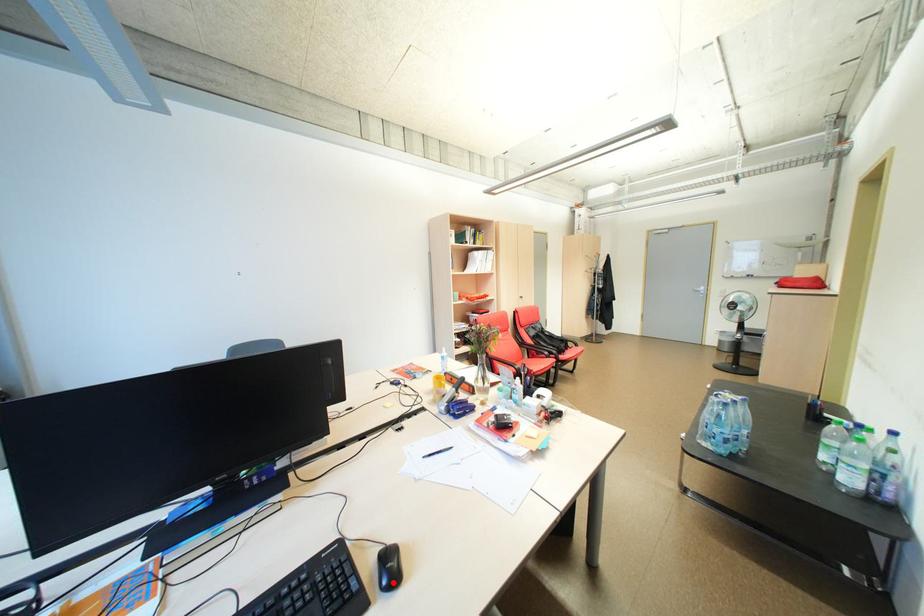
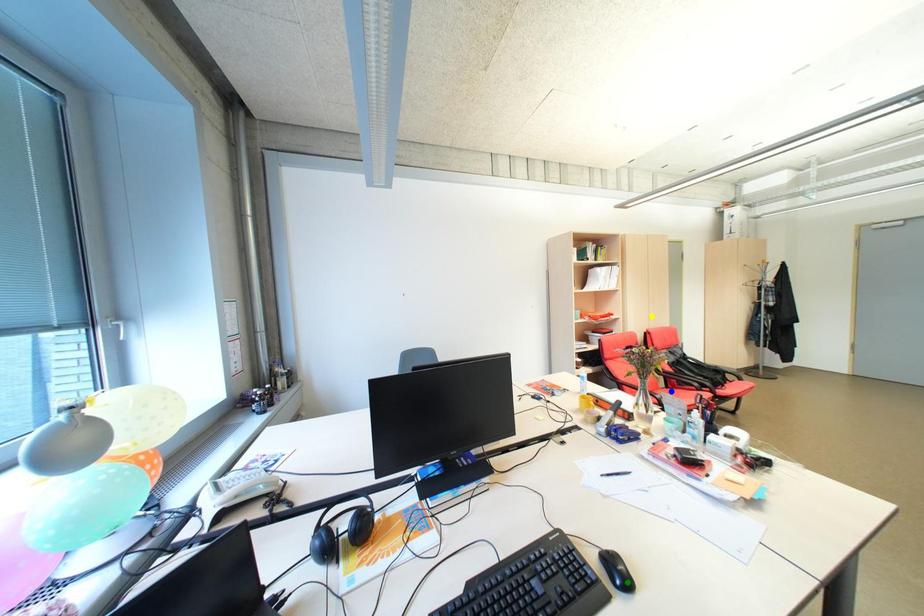
Question: I am providing you with two images of the same scene from different viewpoints. A red point is marked on the first image. You are given multiple points on the second image. Which point in image 2 is actually the same real-world point as the red point in image 1?

Choices:
 (A) yellow point
 (B) blue point
 (C) green point

Answer: (C)